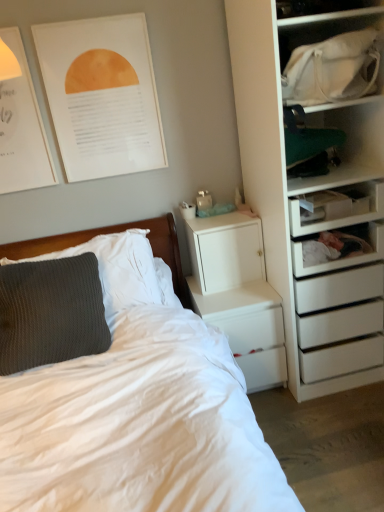
Question: Is white glossy nightstand at lower center next to white fabric bag at upper right and touching it?

Choices:
 (A) no
 (B) yes

Answer: (A)

Question: Is white glossy nightstand at lower center facing away from white fabric bag at upper right?

Choices:
 (A) yes
 (B) no

Answer: (B)

Question: Is white glossy nightstand at lower center far away from white fabric bag at upper right?

Choices:
 (A) yes
 (B) no

Answer: (B)

Question: Is the position of white glossy nightstand at lower center less distant than that of white fabric bag at upper right?

Choices:
 (A) no
 (B) yes

Answer: (A)

Question: Is white glossy nightstand at lower center to the left of white fabric bag at upper right from the viewer's perspective?

Choices:
 (A) yes
 (B) no

Answer: (A)

Question: Is white glossy nightstand at lower center not inside white fabric bag at upper right?

Choices:
 (A) no
 (B) yes

Answer: (B)

Question: Does white fabric bag at upper right have a greater width compared to white glossy nightstand at lower center?

Choices:
 (A) no
 (B) yes

Answer: (A)

Question: Is white fabric bag at upper right far from white glossy nightstand at lower center?

Choices:
 (A) no
 (B) yes

Answer: (A)

Question: Can you confirm if white fabric bag at upper right is positioned to the right of white glossy nightstand at lower center?

Choices:
 (A) yes
 (B) no

Answer: (A)

Question: Can we say white fabric bag at upper right lies outside white glossy nightstand at lower center?

Choices:
 (A) no
 (B) yes

Answer: (B)

Question: Does white fabric bag at upper right have a lesser height compared to white glossy nightstand at lower center?

Choices:
 (A) yes
 (B) no

Answer: (A)

Question: Can you confirm if white fabric bag at upper right is smaller than white glossy nightstand at lower center?

Choices:
 (A) no
 (B) yes

Answer: (B)

Question: Is white soft bed at left at the left side of white matte/file cabinet at upper right?

Choices:
 (A) yes
 (B) no

Answer: (A)